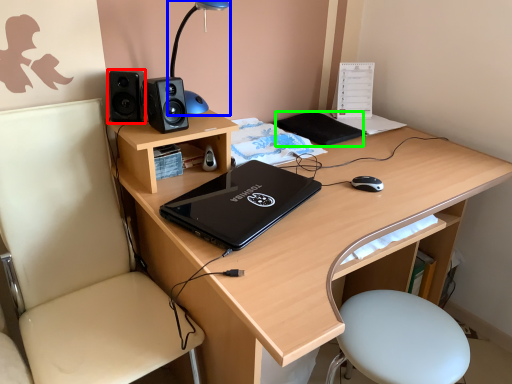
Question: Which is nearer to the speaker (highlighted by a red box)? table lamp (highlighted by a blue box) or notepad (highlighted by a green box).

Choices:
 (A) table lamp
 (B) notepad

Answer: (A)